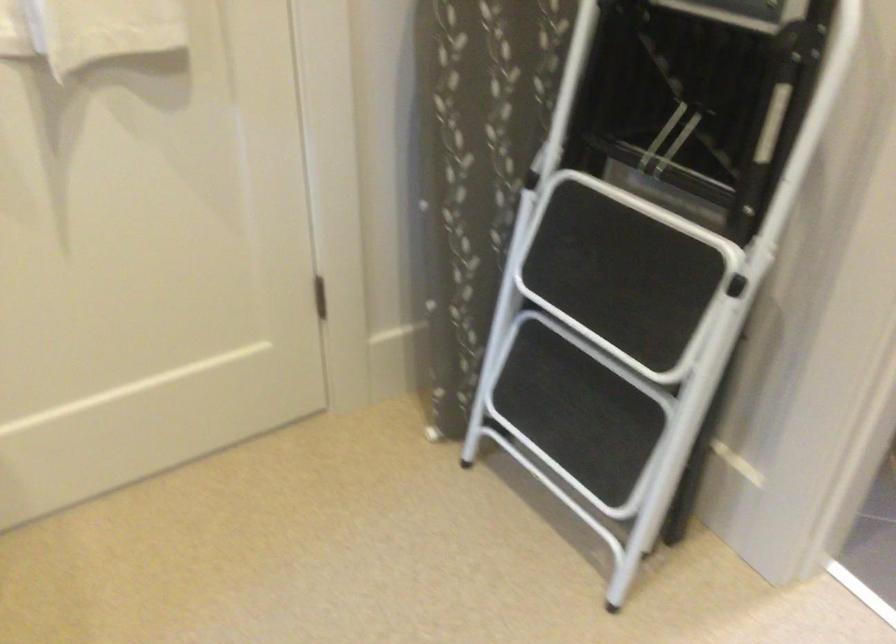
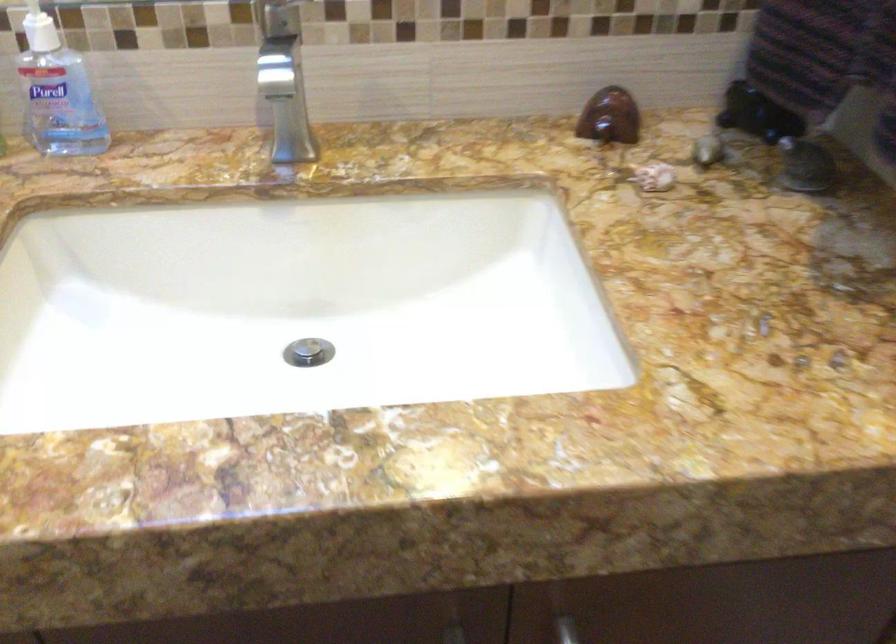
Which direction would the cameraman need to move to produce the second image?

The cameraman walked toward right, forward.